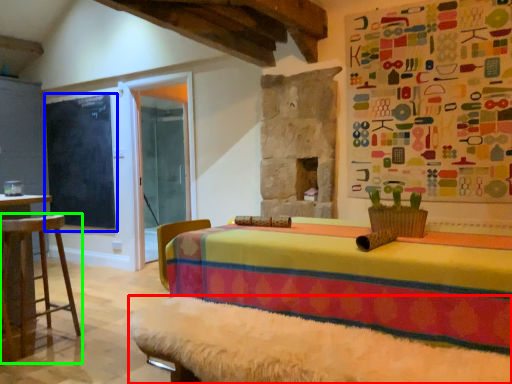
Question: Which object is the farthest from bed frame (highlighted by a red box)? Choose among these: bulletin board (highlighted by a blue box) or furniture (highlighted by a green box).

Choices:
 (A) bulletin board
 (B) furniture

Answer: (A)